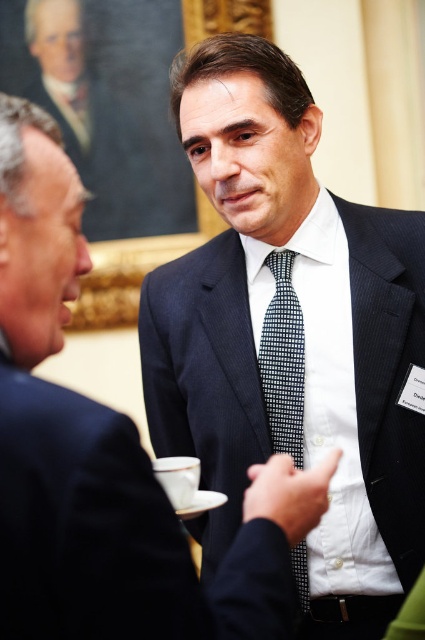
Between navy wool suit at center and dark blue textured tie at center, which one is positioned lower?

Positioned lower is navy wool suit at center.

Is navy wool suit at center taller than dark blue textured tie at center?

No, navy wool suit at center is not taller than dark blue textured tie at center.

This screenshot has width=425, height=640. I want to click on navy wool suit at center, so click(113, 534).

Does dark blue suit at center have a larger size compared to navy wool suit at center?

Correct, dark blue suit at center is larger in size than navy wool suit at center.

Measure the distance between dark blue suit at center and camera.

The distance of dark blue suit at center from camera is 7.73 feet.

Identify the location of dark blue suit at center. The image size is (425, 640). (291, 337).

Consider the image. Can you confirm if dark blue suit at center is positioned below navy blue suit at center?

No.

Is point (308, 138) in front of point (251, 547)?

No, it is behind (251, 547).

I want to click on dark blue suit at center, so click(x=291, y=337).